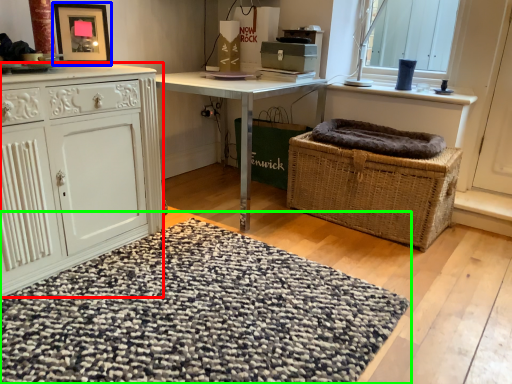
Question: Which is nearer to the cabinetry (highlighted by a red box)? picture frame (highlighted by a blue box) or doormat (highlighted by a green box).

Choices:
 (A) picture frame
 (B) doormat

Answer: (B)